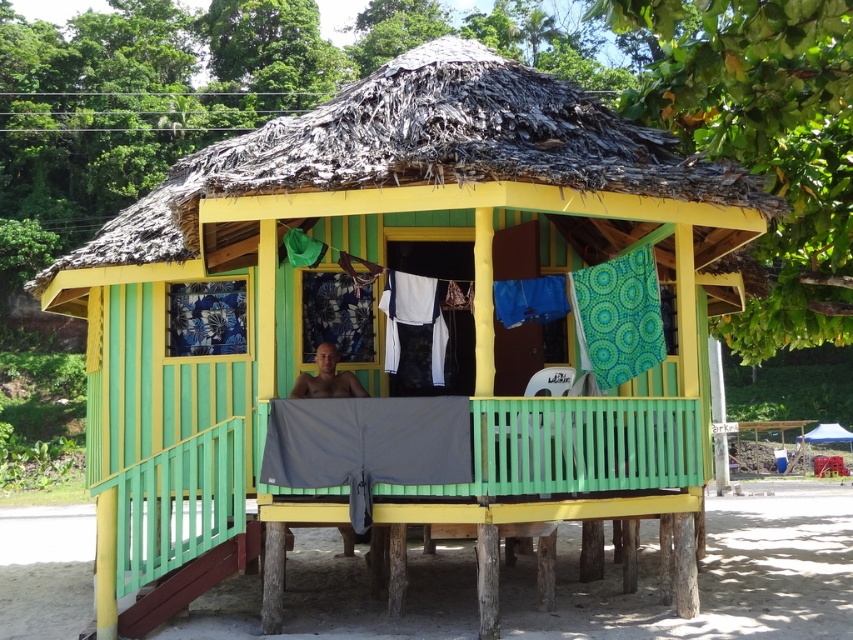
You are standing at the entrance of the hut and see the point marked as point [328,378]. Is this point located inside the hut or outside?

The point [328,378] represents the smooth skin man at center, who is inside the hut, so the point is located inside the hut.

You are a photographer standing at the entrance of the hut. You want to take a photo of the smooth skin man at center and the blue fabric canopy at upper right in the same frame. Given that your camera has a maximum zoom range of 20 meters, can you capture both objects in the same photo without moving your position?

The smooth skin man at center and the blue fabric canopy at upper right are 23.70 meters apart. Since the camera can only zoom up to 20 meters, the distance between them exceeds the maximum zoom range. Therefore, you cannot capture both objects in the same photo without moving your position.

You are standing in front of the hut and want to determine the relative positions of two points marked on the structure. The first point is located at coordinates point [312,381], and the second is at point [822,440]. Which point is closer to your current position?

Point [312,381] is closer to the camera than point [822,440], so the first point is closer to your position.